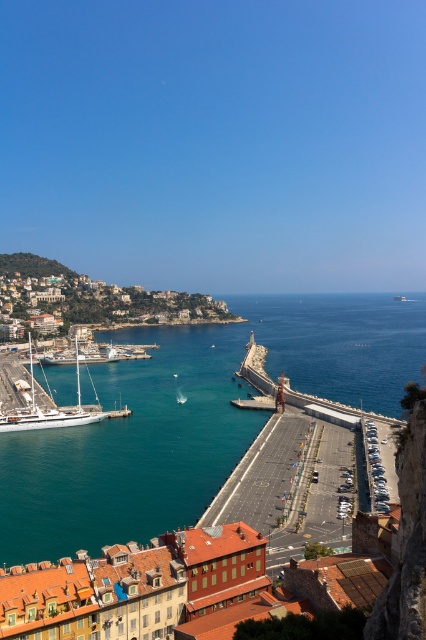
Question: Considering the relative positions of teal glossy water at center and matte stone buildings at left in the image provided, where is teal glossy water at center located with respect to matte stone buildings at left?

Choices:
 (A) right
 (B) left

Answer: (A)

Question: Is matte stone buildings at left closer to the viewer compared to white glossy sailboat at left?

Choices:
 (A) no
 (B) yes

Answer: (A)

Question: Which point is farther to the camera?

Choices:
 (A) (149, 445)
 (B) (135, 304)

Answer: (B)

Question: Which point is closer to the camera?

Choices:
 (A) (31, 506)
 (B) (86, 316)
 (C) (29, 364)

Answer: (A)

Question: Which is nearer to the teal glossy water at center?

Choices:
 (A) blue water at center
 (B) matte stone buildings at left

Answer: (B)

Question: Does teal glossy water at center come in front of white glossy sailboat at left?

Choices:
 (A) yes
 (B) no

Answer: (A)